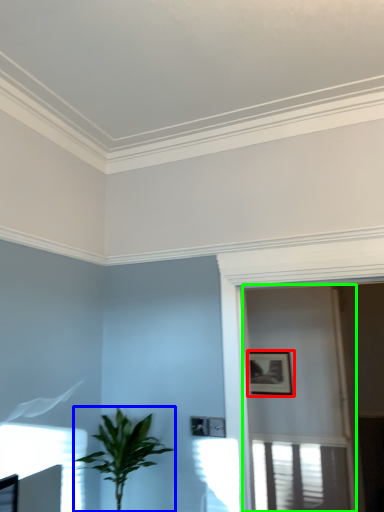
Question: Which object is the closest to the picture frame (highlighted by a red box)? Choose among these: houseplant (highlighted by a blue box) or screen door (highlighted by a green box).

Choices:
 (A) houseplant
 (B) screen door

Answer: (B)